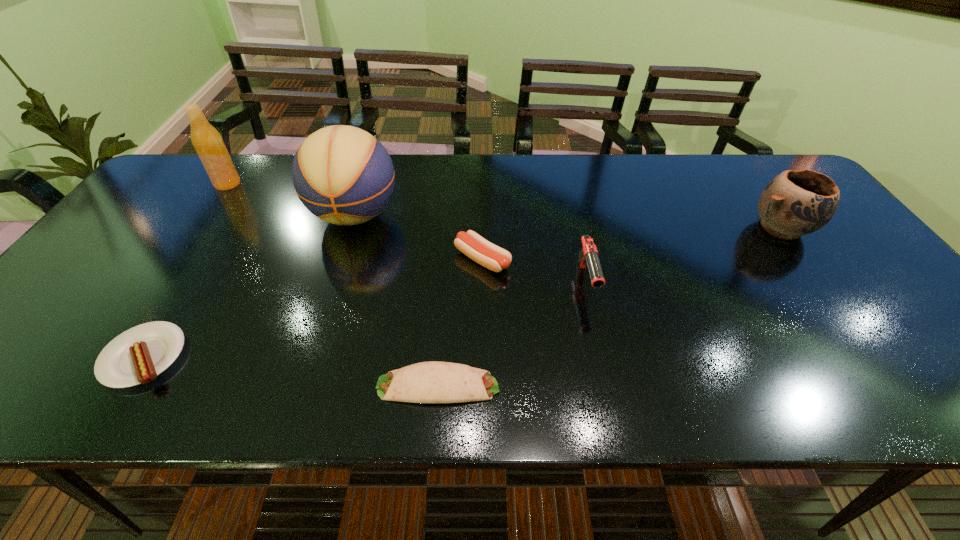
Where is `sausage present at the near edge`? The height and width of the screenshot is (540, 960). sausage present at the near edge is located at coordinates (137, 356).

At what (x,y) coordinates should I click in order to perform the action: click on burrito that is at the near edge. Please return your answer as a coordinate pair (x, y). This screenshot has width=960, height=540. Looking at the image, I should click on (427, 382).

This screenshot has width=960, height=540. Identify the location of object situated at the right edge. (795, 203).

Where is `free location at the far edge of the desktop`? The image size is (960, 540). free location at the far edge of the desktop is located at coordinates (650, 164).

Find the location of `free space at the near edge of the desktop`. free space at the near edge of the desktop is located at coordinates point(617,393).

Identify the location of vacant area at the left edge of the desktop. (45, 351).

This screenshot has width=960, height=540. Find the location of `vacant space at the right edge of the desktop`. vacant space at the right edge of the desktop is located at coordinates (868, 297).

Find the location of `vacant space at the far left corner`. vacant space at the far left corner is located at coordinates (201, 195).

This screenshot has width=960, height=540. Identify the location of empty space that is in between the sixth object from left to right and the beer bottle. (407, 233).

The image size is (960, 540). What are the coordinates of `free space that is in between the fourth shortest object and the left sausage` in the screenshot? It's located at (365, 320).